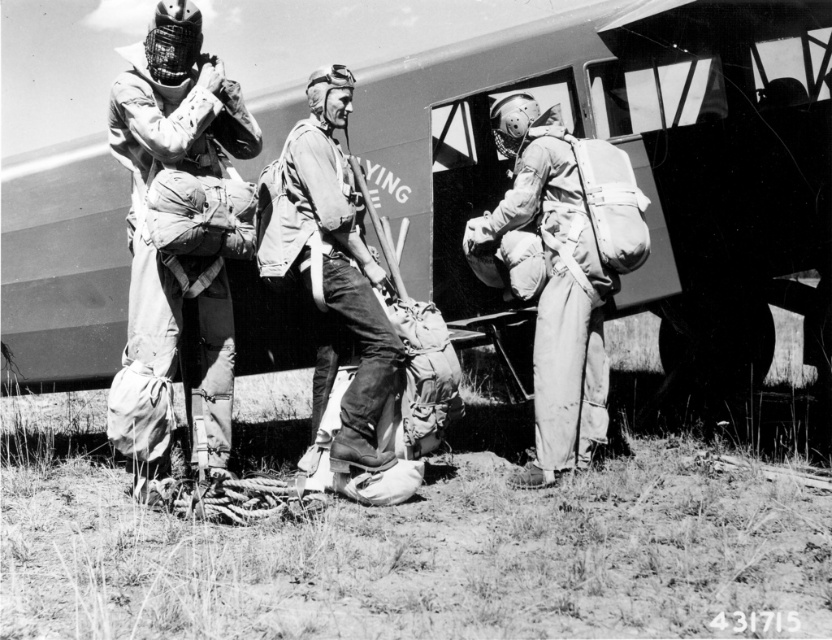
Question: Which of these objects is positioned farthest from the matte khaki jumpsuit at left?

Choices:
 (A) matte khaki uniform at center
 (B) matte khaki jumpsuit at center
 (C) metallic fuselage at center

Answer: (C)

Question: Is metallic fuselage at center to the right of matte khaki uniform at center from the viewer's perspective?

Choices:
 (A) yes
 (B) no

Answer: (A)

Question: Which of these objects is positioned farthest from the matte khaki jumpsuit at center?

Choices:
 (A) metallic fuselage at center
 (B) matte khaki uniform at center

Answer: (A)

Question: Which of the following is the farthest from the observer?

Choices:
 (A) metallic fuselage at center
 (B) matte khaki jumpsuit at center
 (C) matte khaki jumpsuit at left
 (D) matte khaki uniform at center

Answer: (A)

Question: Can you confirm if matte khaki jumpsuit at left is positioned to the right of matte khaki jumpsuit at center?

Choices:
 (A) yes
 (B) no

Answer: (B)

Question: Does metallic fuselage at center have a smaller size compared to matte khaki uniform at center?

Choices:
 (A) no
 (B) yes

Answer: (A)